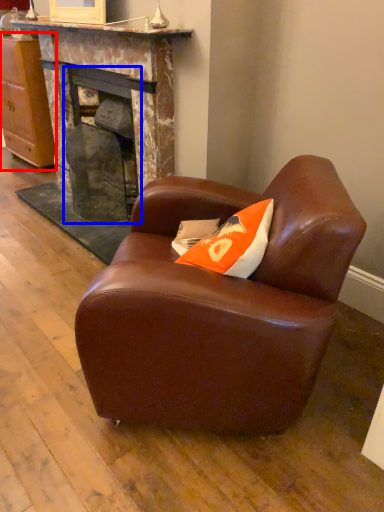
Question: Which object is further to the camera taking this photo, cabinetry (highlighted by a red box) or fireplace (highlighted by a blue box)?

Choices:
 (A) cabinetry
 (B) fireplace

Answer: (A)